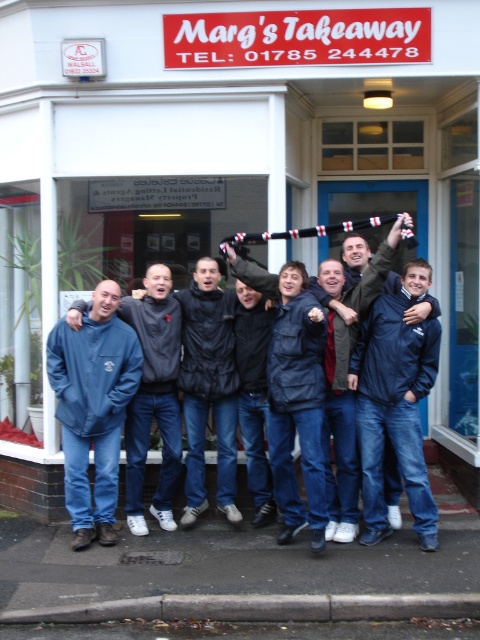
Question: Which is nearer to the dark blue jacket at center?

Choices:
 (A) navy blue jacket at center
 (B) blue fleece jacket at center

Answer: (A)

Question: Which object is the closest to the dark blue jacket at center?

Choices:
 (A) navy blue jacket at center
 (B) blue fleece jacket at center

Answer: (A)

Question: Where is navy blue jacket at center located in relation to dark blue jacket at center in the image?

Choices:
 (A) below
 (B) above

Answer: (A)

Question: In this image, where is navy blue jacket at center located relative to dark blue jacket at center?

Choices:
 (A) below
 (B) above

Answer: (A)

Question: Does blue fleece jacket at center have a greater width compared to dark blue jacket at center?

Choices:
 (A) yes
 (B) no

Answer: (B)

Question: Which object is the farthest from the dark blue jacket at center?

Choices:
 (A) navy blue jacket at center
 (B) blue fleece jacket at center

Answer: (B)